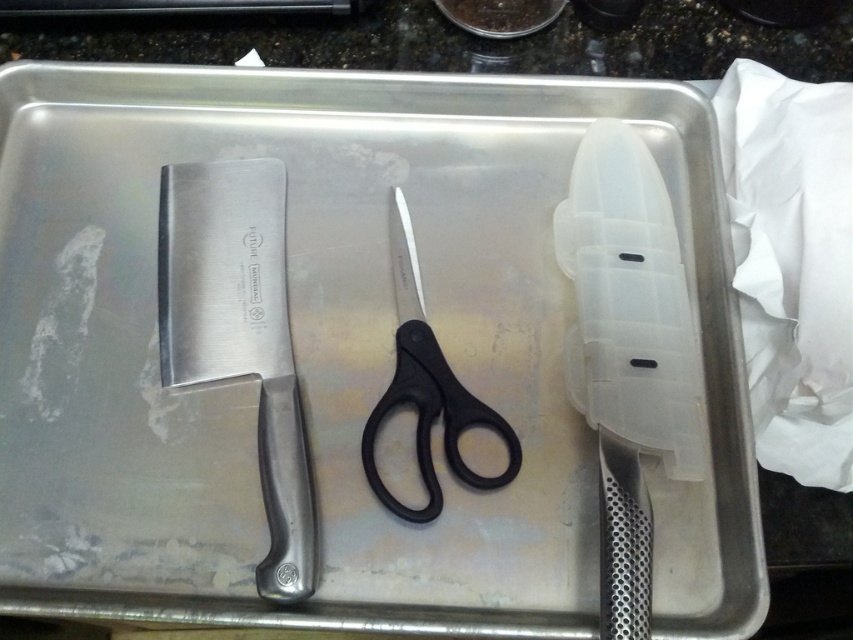
You are a chef holding a knife and need to reach the transparent plastic razor at center without moving the large cleaver knife on the left. Can you safely extend your hand to grab it? Explain why or why not.

The transparent plastic razor at center and viewer are 52.99 centimeters apart. Since the distance is sufficient, you can safely extend your hand to grab it without disturbing the large cleaver knife on the left.

You are a chef preparing to use the polished metal knife at left and the pair of scissors in the center. You need to reach for the closest object first. Which one should you grab?

The polished metal knife at left is closer to you at 22.63 inches from the viewer, so you should grab the polished metal knife at left first.

You are a chef preparing to use a tool. You need to pick up the transparent plastic razor at center and the polished metal knife at left from the tray. Which one do you need to pick up first, and why?

You should pick up the transparent plastic razor at center first because it is located above the polished metal knife at left, so you need to remove it to access the knife underneath.